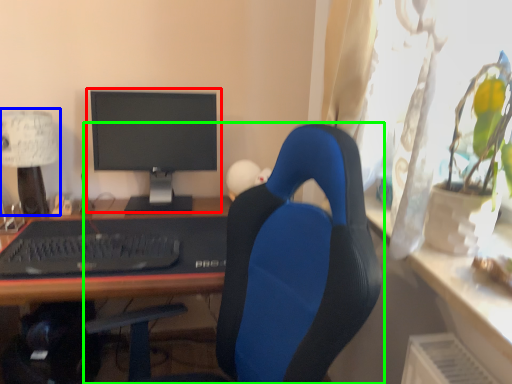
Question: Based on their relative distances, which object is nearer to computer monitor (highlighted by a red box)? Choose from table lamp (highlighted by a blue box) and chair (highlighted by a green box).

Choices:
 (A) table lamp
 (B) chair

Answer: (A)